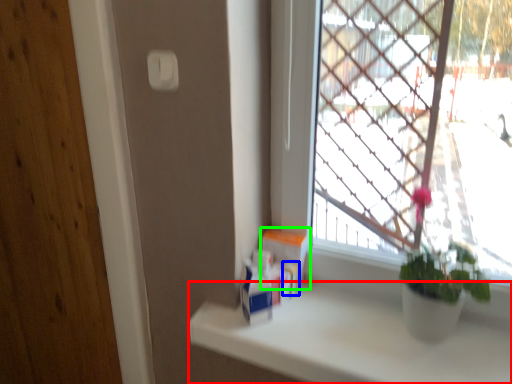
Question: Which is farther away from counter top (highlighted by a red box)? toiletry (highlighted by a blue box) or window box (highlighted by a green box)?

Choices:
 (A) toiletry
 (B) window box

Answer: (B)